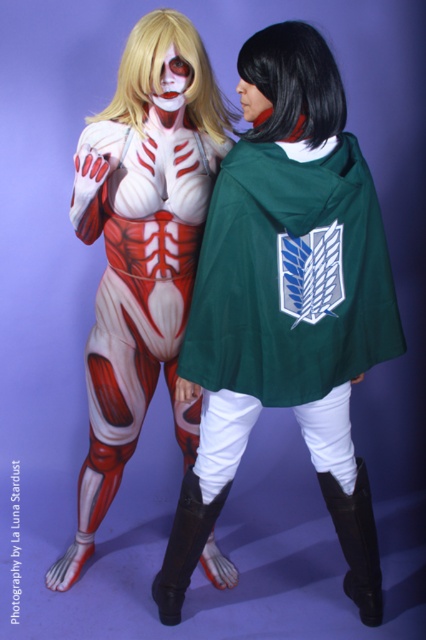
Question: Which point appears farthest from the camera in this image?

Choices:
 (A) (276, 97)
 (B) (204, 115)

Answer: (B)

Question: Does green fabric cape at center have a greater width compared to blonde wig at upper center?

Choices:
 (A) no
 (B) yes

Answer: (B)

Question: Where is green fabric cape at center located in relation to black silky wig at center in the image?

Choices:
 (A) left
 (B) right

Answer: (B)

Question: Which is nearer to the black silky wig at center?

Choices:
 (A) green fabric cape at center
 (B) blonde wig at upper center

Answer: (B)

Question: Does green fabric cape at center appear on the left side of black silky wig at center?

Choices:
 (A) no
 (B) yes

Answer: (A)

Question: Based on their relative distances, which object is farther from the blonde wig at upper center?

Choices:
 (A) black silky wig at center
 (B) green fabric cape at center

Answer: (B)